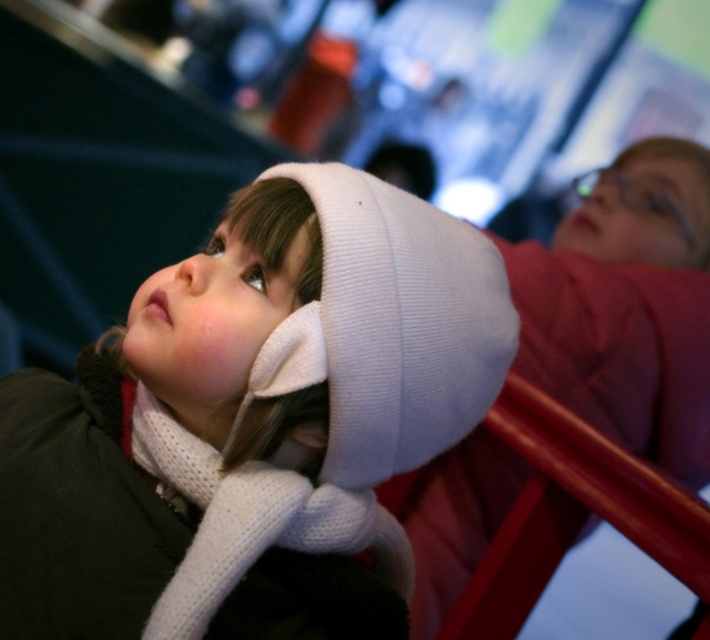
Between white knitted hat at upper left and white knit hat at upper right, which one appears on the left side from the viewer's perspective?

Positioned to the left is white knitted hat at upper left.

Between white knitted hat at upper left and white knit hat at upper right, which one is positioned higher?

Positioned higher is white knit hat at upper right.

Image resolution: width=710 pixels, height=640 pixels. What do you see at coordinates (253, 422) in the screenshot? I see `white knitted hat at upper left` at bounding box center [253, 422].

In order to click on white knitted hat at upper left in this screenshot , I will do `click(253, 422)`.

Which is above, white knit hat at upper right or white knitted scarf at lower left?

white knit hat at upper right is above.

Is white knit hat at upper right shorter than white knitted scarf at lower left?

No.

The image size is (710, 640). What do you see at coordinates (626, 305) in the screenshot?
I see `white knit hat at upper right` at bounding box center [626, 305].

This screenshot has width=710, height=640. In order to click on white knit hat at upper right in this screenshot , I will do `click(626, 305)`.

Describe the element at coordinates (253, 422) in the screenshot. I see `white knitted hat at upper left` at that location.

Does white knitted hat at upper left have a smaller size compared to white knitted scarf at lower left?

Incorrect, white knitted hat at upper left is not smaller in size than white knitted scarf at lower left.

Describe the element at coordinates (253, 422) in the screenshot. The image size is (710, 640). I see `white knitted hat at upper left` at that location.

Where is `white knitted hat at upper left`? Image resolution: width=710 pixels, height=640 pixels. white knitted hat at upper left is located at coordinates (253, 422).